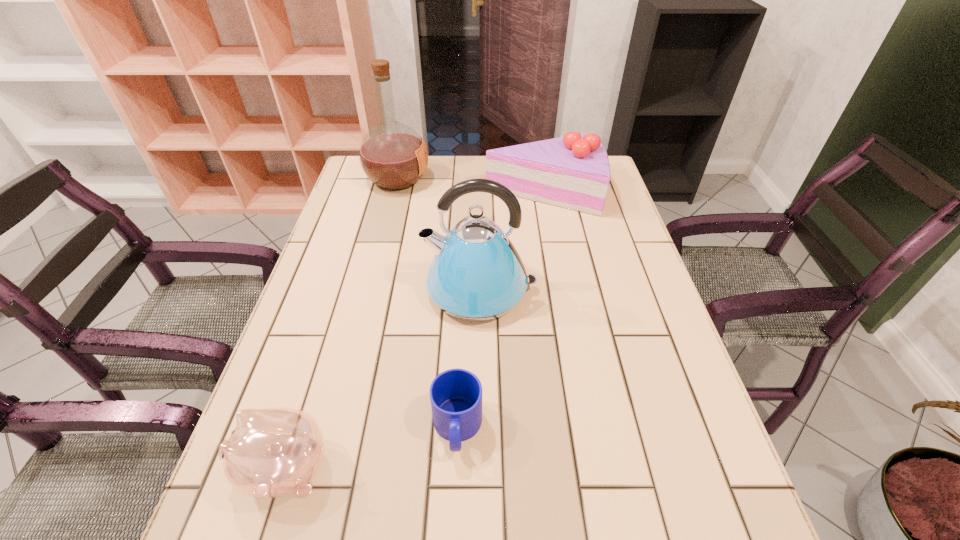
The width and height of the screenshot is (960, 540). Identify the location of liquor. click(x=393, y=156).

What are the coordinates of `the fourth shortest object` in the screenshot? It's located at (476, 274).

This screenshot has height=540, width=960. Identify the location of the third nearest object. (476, 274).

Where is `cake`? Image resolution: width=960 pixels, height=540 pixels. cake is located at coordinates (573, 172).

Identify the location of piggy bank. The image size is (960, 540). (273, 452).

Locate an element on the screen. Image resolution: width=960 pixels, height=540 pixels. the shortest object is located at coordinates (456, 394).

Where is `free location located 0.120m on the front label of the liquor`? Image resolution: width=960 pixels, height=540 pixels. free location located 0.120m on the front label of the liquor is located at coordinates (467, 179).

The width and height of the screenshot is (960, 540). What are the coordinates of `free region located 0.190m at the spout of the fourth shortest object` in the screenshot? It's located at (348, 289).

I want to click on free space located at the spout of the fourth shortest object, so click(x=340, y=289).

Locate an element on the screen. The height and width of the screenshot is (540, 960). free spot located at the spout of the fourth shortest object is located at coordinates (327, 289).